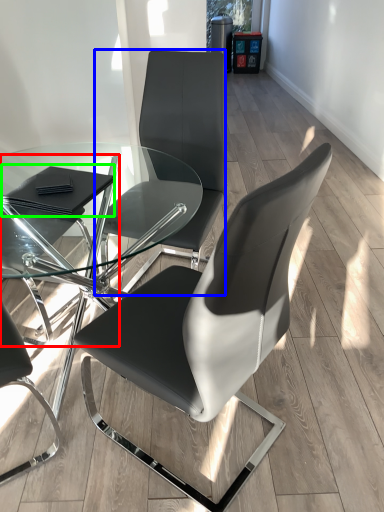
Question: Which object is positioned closest to chair (highlighted by a red box)? Select from chair (highlighted by a blue box) and pad (highlighted by a green box).

Choices:
 (A) chair
 (B) pad

Answer: (B)